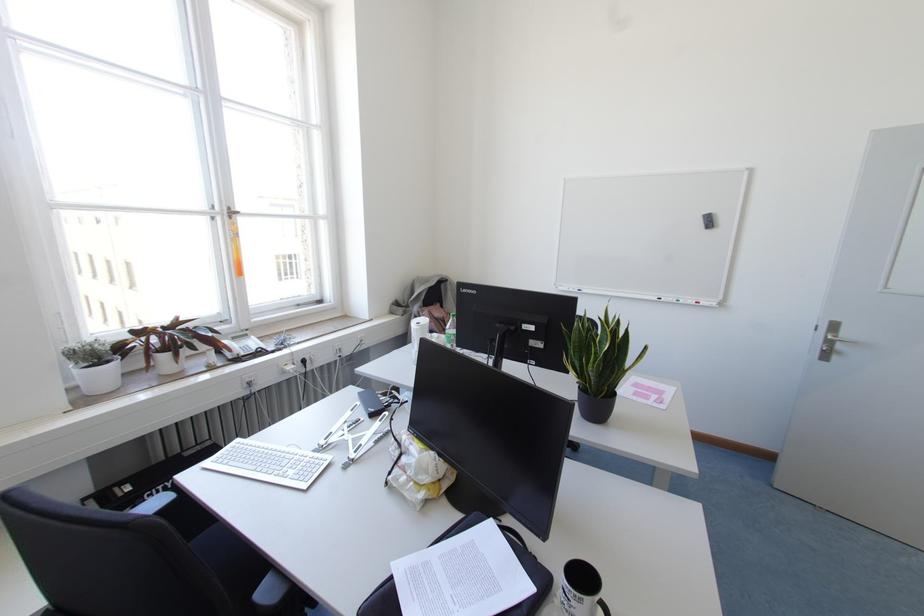
Identify the location of white telephone handset. click(244, 347).